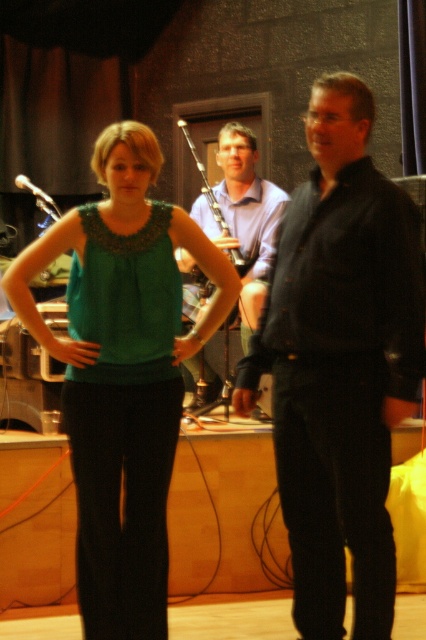
You are an event planner trying to place a small podium for a speaker. The podium needs to be placed in the center of the image. Is the black textured suit at center currently blocking that area?

The black textured suit at center is located at point [339,364], which is near the center of the image but slightly offset. Since the exact center is at point [213,320], the black textured suit at center is not exactly blocking the center, but is nearby. The planner should check if the podium can be placed slightly to the left and above the current position of the black textured suit at center to avoid obstruction.

You are an event planner arranging a stage for a performance. You have two items to place on the stage, the black textured suit at center and the matte wood flute at center. Given their sizes, which item should you place closer to the audience to ensure it appears the same size as the other from the audience viewpoint?

The black textured suit at center is smaller than the matte wood flute at center. To make them appear the same size from the audience viewpoint, place the smaller black textured suit at center closer to the audience and the larger matte wood flute at center further back.